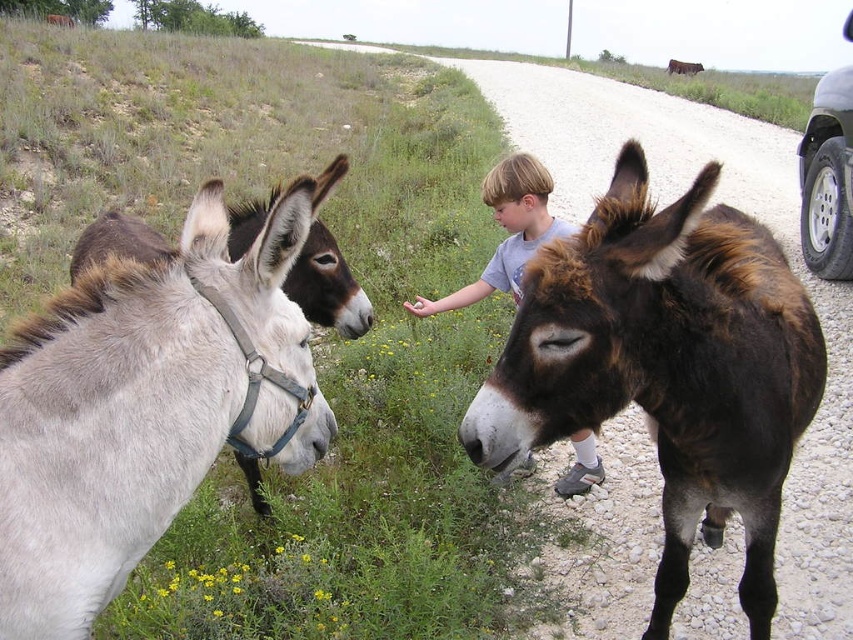
Which of these two, brown fuzzy donkey at right or brown fuzzy mule at right, stands shorter?

With less height is brown fuzzy donkey at right.

Can you confirm if brown fuzzy donkey at right is thinner than brown fuzzy mule at right?

Yes.

Is point (689, 442) farther from viewer compared to point (695, 61)?

No.

Image resolution: width=853 pixels, height=640 pixels. Identify the location of brown fuzzy donkey at right. (666, 365).

Image resolution: width=853 pixels, height=640 pixels. Describe the element at coordinates (827, 179) in the screenshot. I see `metallic gray tire at right` at that location.

Is point (843, 209) positioned behind point (670, 68)?

No, it is in front of (670, 68).

I want to click on metallic gray tire at right, so click(x=827, y=179).

This screenshot has height=640, width=853. Describe the element at coordinates (328, 285) in the screenshot. I see `gray soft fur mule at left` at that location.

Does gray soft fur mule at left appear on the left side of light gray t-shirt at center?

Indeed, gray soft fur mule at left is positioned on the left side of light gray t-shirt at center.

Between point (349, 337) and point (482, 285), which one is positioned behind?

Point (482, 285)

Image resolution: width=853 pixels, height=640 pixels. Identify the location of gray soft fur mule at left. (328, 285).